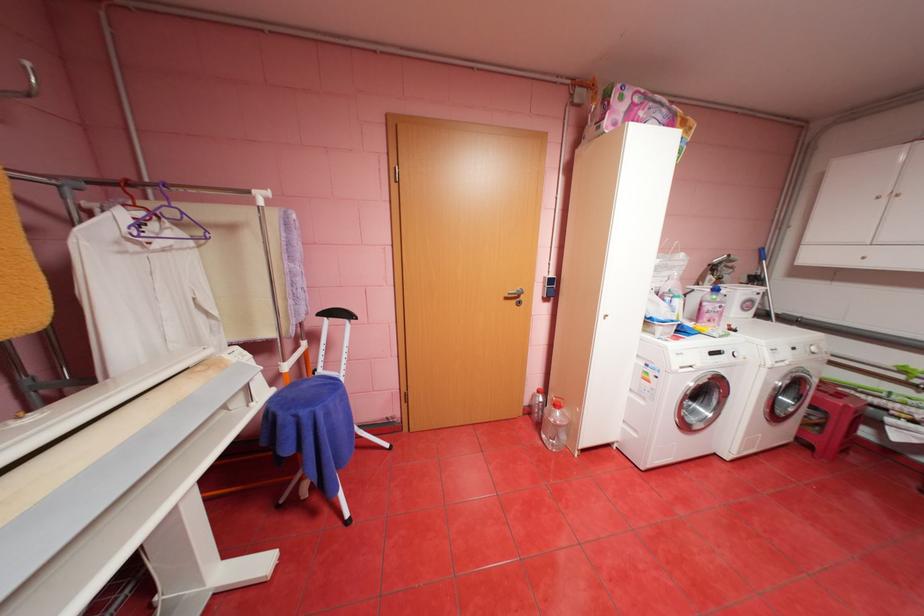
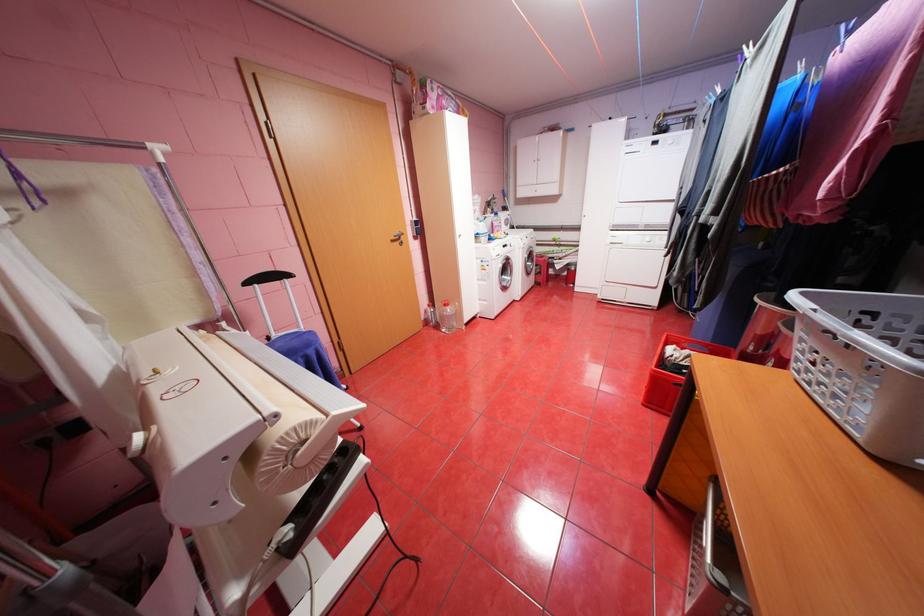
Where in the second image is the point corresponding to the point at 548,426 from the first image?

(445, 326)